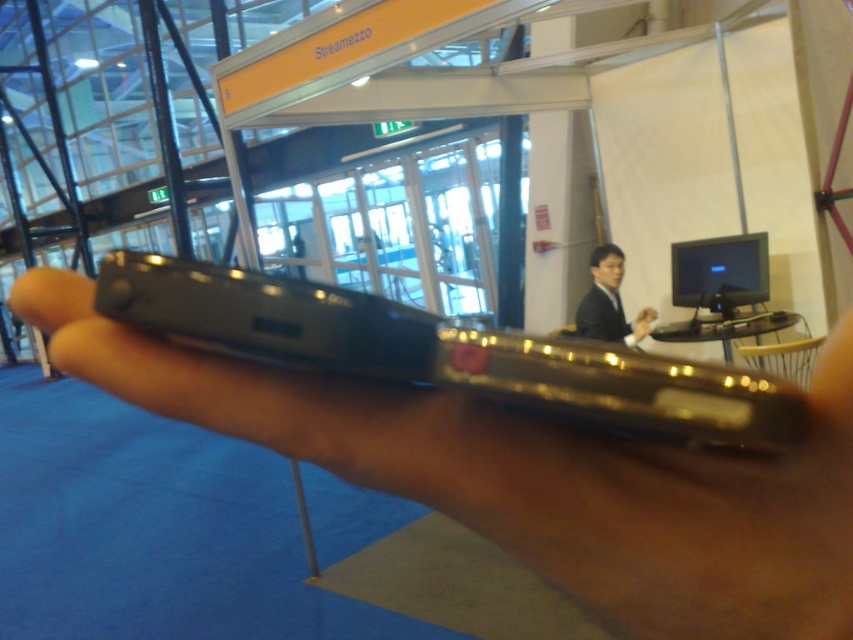
Question: In this image, where is black matte phone at center located relative to black suit at center?

Choices:
 (A) left
 (B) right

Answer: (A)

Question: Can you confirm if black matte phone at center is positioned to the left of black suit at center?

Choices:
 (A) no
 (B) yes

Answer: (B)

Question: Among these points, which one is farthest from the camera?

Choices:
 (A) (604, 460)
 (B) (596, 326)

Answer: (B)

Question: Can you confirm if black matte phone at center is thinner than black suit at center?

Choices:
 (A) no
 (B) yes

Answer: (B)

Question: Which point is farther to the camera?

Choices:
 (A) (223, 364)
 (B) (601, 275)

Answer: (B)

Question: Which point is closer to the camera?

Choices:
 (A) (801, 563)
 (B) (606, 314)

Answer: (A)